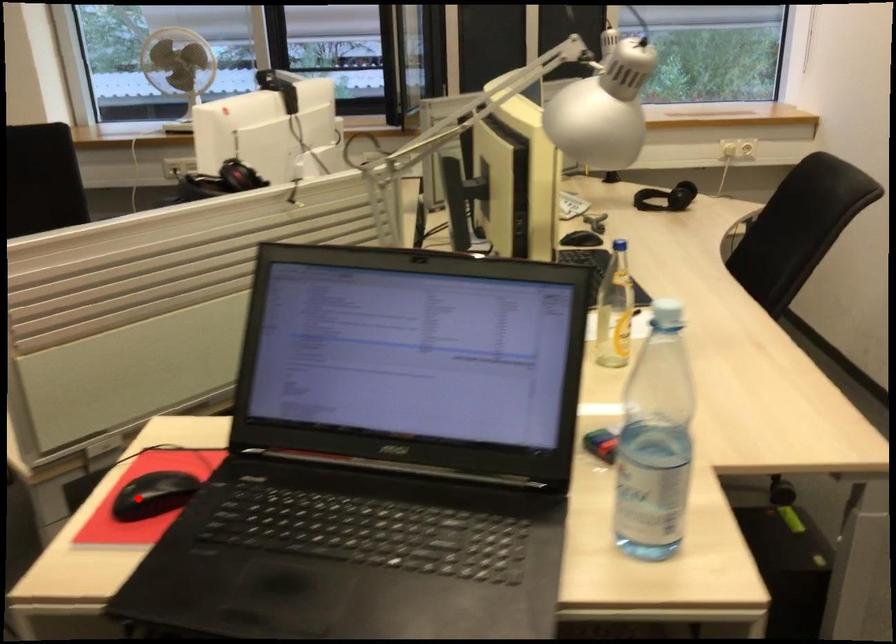
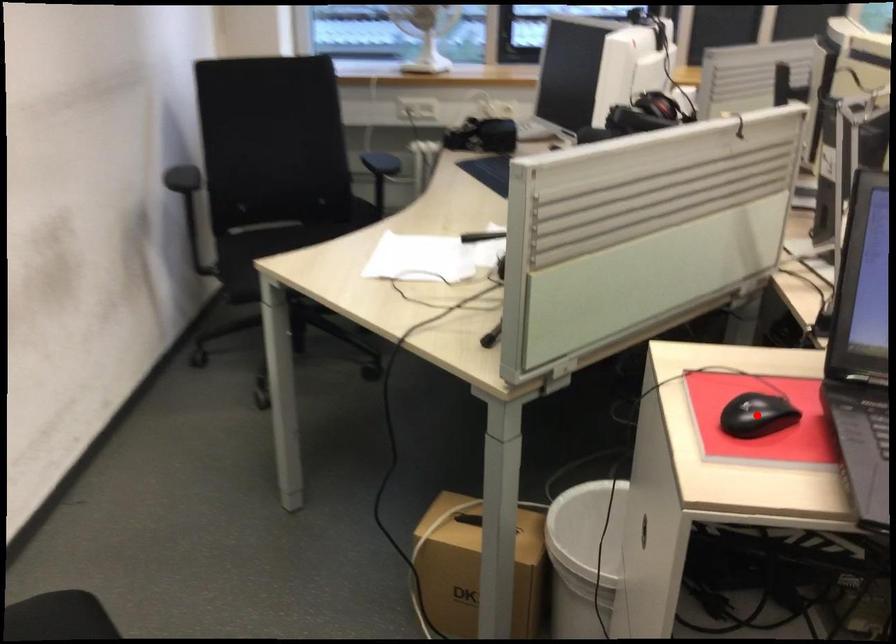
I am providing you with two images of the same scene from different viewpoints. A red point is marked on the first image and another point is marked on the second image. Is the red point in image1 aligned with the point shown in image2?

Yes